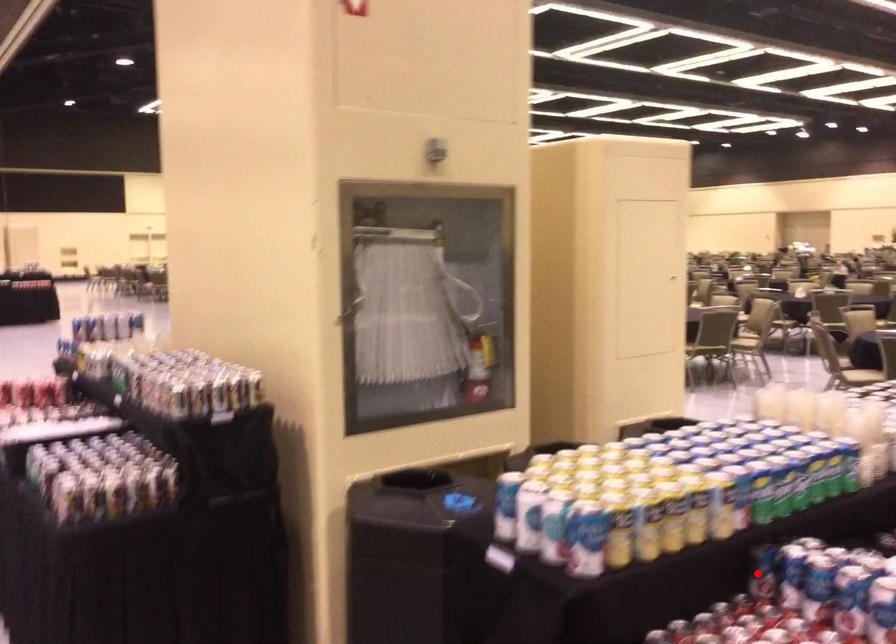
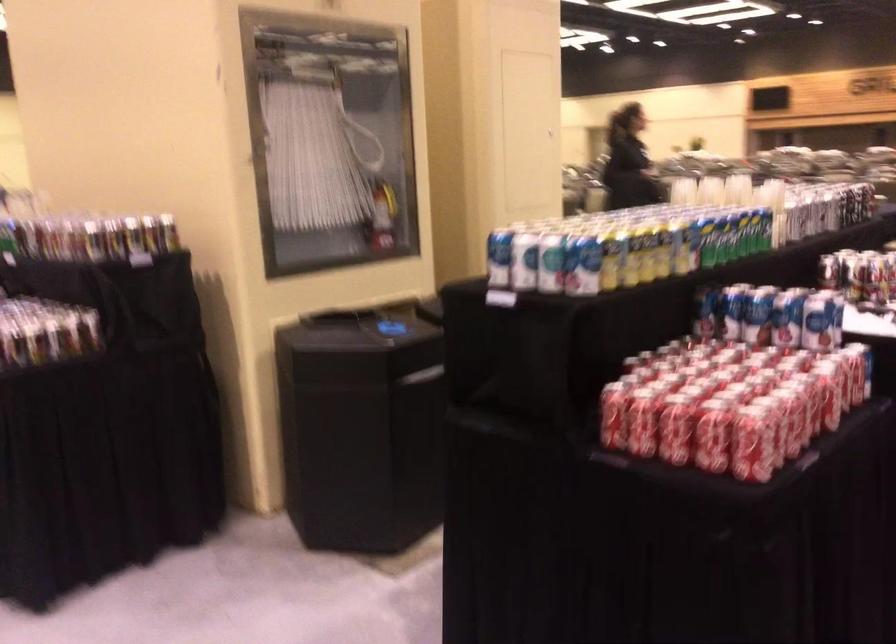
Question: I am providing you with two images of the same scene from different viewpoints. Given a red point in image1, look at the same physical point in image2. Is it:

Choices:
 (A) Closer to the viewpoint
 (B) Farther from the viewpoint

Answer: (B)